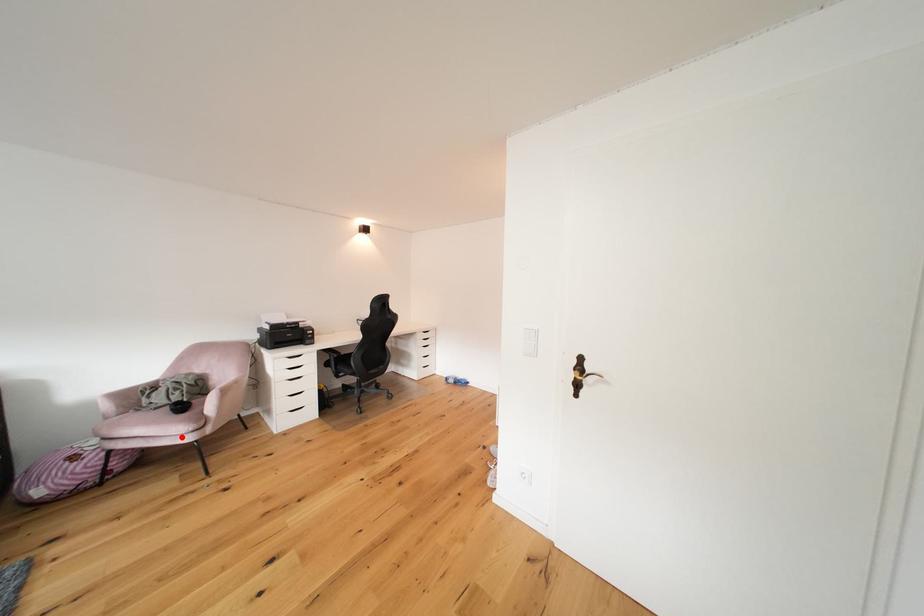
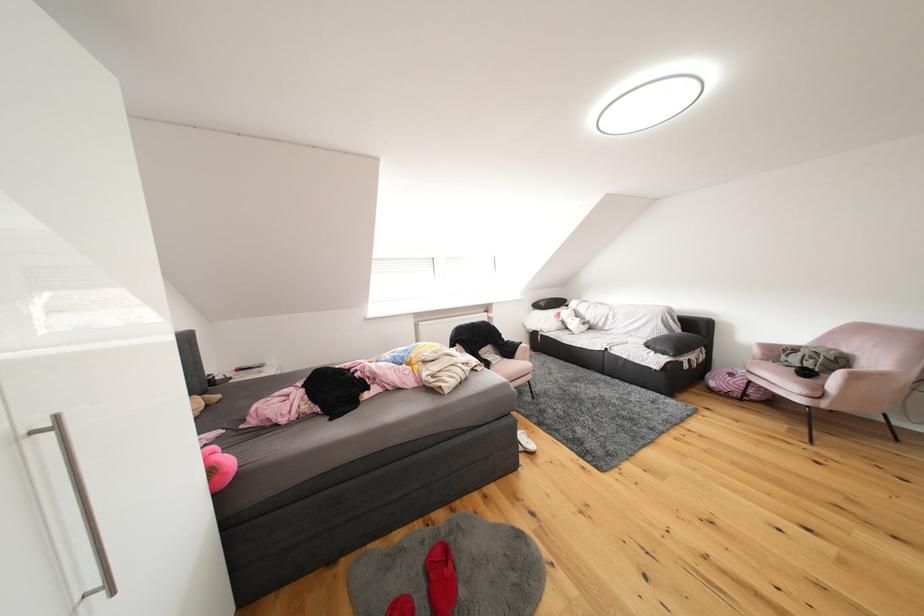
Question: I am providing you with two images of the same scene from different viewpoints. A red point is shown in image1. For the corresponding object point in image2, is it positioned nearer or farther from the camera?

Choices:
 (A) Nearer
 (B) Farther

Answer: (A)